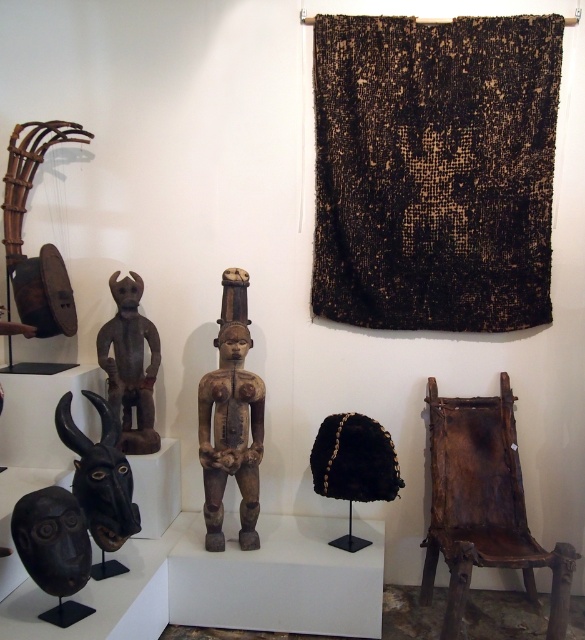
Question: In this image, where is brown leather chair at lower right located relative to brown wooden figure at left?

Choices:
 (A) right
 (B) left

Answer: (A)

Question: Can you confirm if black woven cloth at upper center is positioned to the right of brown wooden figure at center?

Choices:
 (A) yes
 (B) no

Answer: (A)

Question: Which of these objects is positioned farthest from the brown wooden figure at left?

Choices:
 (A) brown wooden figure at center
 (B) brown leather chair at lower right
 (C) black woven cloth at upper center

Answer: (B)

Question: Which point appears closest to the camera in this image?

Choices:
 (A) (462, 460)
 (B) (201, 428)
 (C) (363, 77)
 (D) (147, 419)

Answer: (B)

Question: Which point appears farthest from the camera in this image?

Choices:
 (A) (553, 573)
 (B) (229, 346)
 (C) (373, 140)
 (D) (132, 445)

Answer: (C)

Question: Is brown leather chair at lower right to the left of brown wooden figure at left from the viewer's perspective?

Choices:
 (A) yes
 (B) no

Answer: (B)